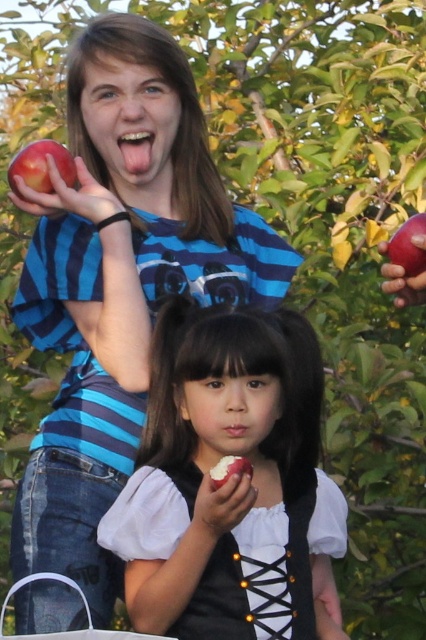
Question: Which of the following is the closest to the observer?

Choices:
 (A) white paper bag at lower left
 (B) red matte apple at lower center
 (C) smooth pink tongue at upper center
 (D) shiny red apple at upper left

Answer: (A)

Question: Does smooth white apple at center appear on the left side of shiny red apple at upper left?

Choices:
 (A) yes
 (B) no

Answer: (B)

Question: Which point appears closest to the camera in this image?

Choices:
 (A) (141, 144)
 (B) (43, 573)
 (C) (423, 218)

Answer: (B)

Question: Is white paper bag at lower left to the left of pink matte lips at center from the viewer's perspective?

Choices:
 (A) no
 (B) yes

Answer: (B)

Question: Estimate the real-world distances between objects in this image. Which object is closer to the red matte apple at upper right?

Choices:
 (A) shiny red apple at upper left
 (B) red matte apple at lower center
 (C) pink matte lips at center

Answer: (C)

Question: Considering the relative positions of smooth white apple at center and shiny red apple at upper left in the image provided, where is smooth white apple at center located with respect to shiny red apple at upper left?

Choices:
 (A) left
 (B) right

Answer: (B)